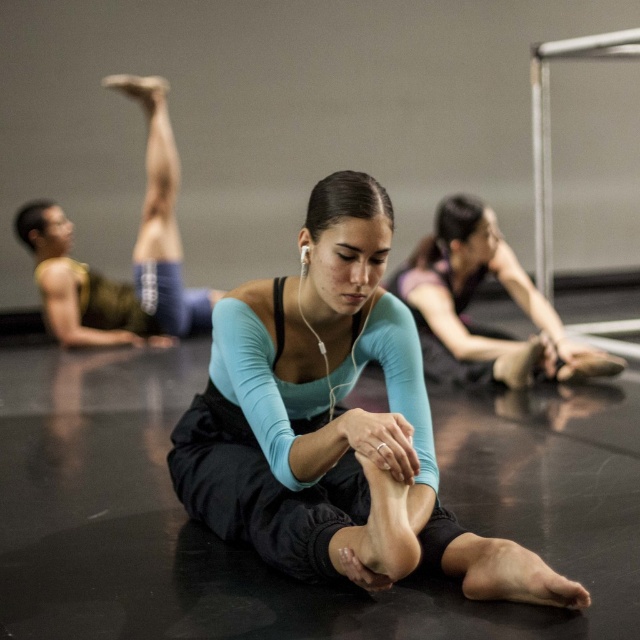
Question: From the image, what is the correct spatial relationship of teal matte leggings at center in relation to matte blue tights at upper left?

Choices:
 (A) below
 (B) above

Answer: (A)

Question: Among these points, which one is farthest from the camera?

Choices:
 (A) (36, 205)
 (B) (451, 240)

Answer: (A)

Question: Which of these objects is positioned farthest from the teal matte leggings at center?

Choices:
 (A) matte blue tights at upper left
 (B) matte blue leggings at center

Answer: (A)

Question: Considering the real-world distances, which object is closest to the teal matte leggings at center?

Choices:
 (A) matte blue tights at upper left
 (B) matte blue leggings at center

Answer: (B)

Question: Is teal matte leggings at center bigger than matte blue leggings at center?

Choices:
 (A) no
 (B) yes

Answer: (B)

Question: Does matte blue tights at upper left appear on the left side of matte blue leggings at center?

Choices:
 (A) yes
 (B) no

Answer: (A)